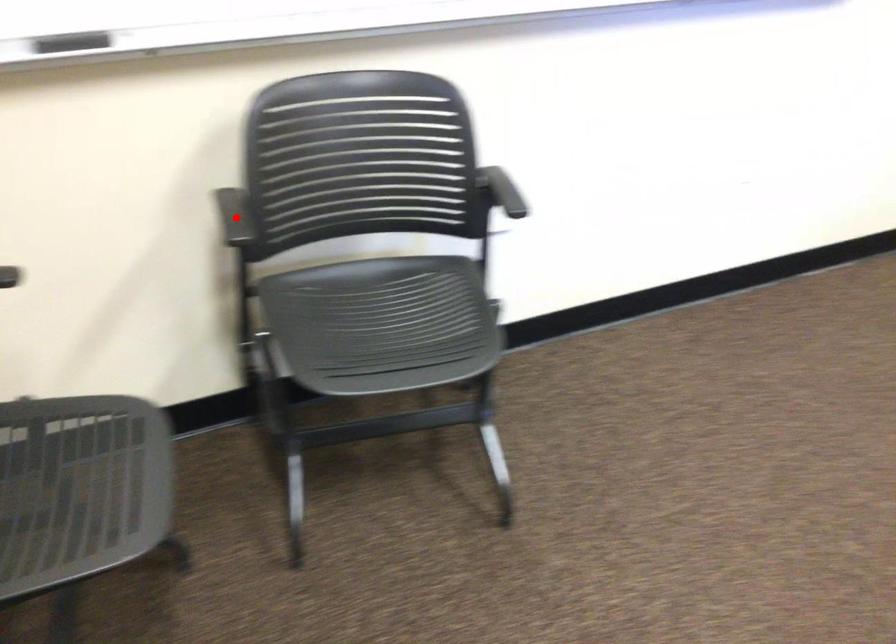
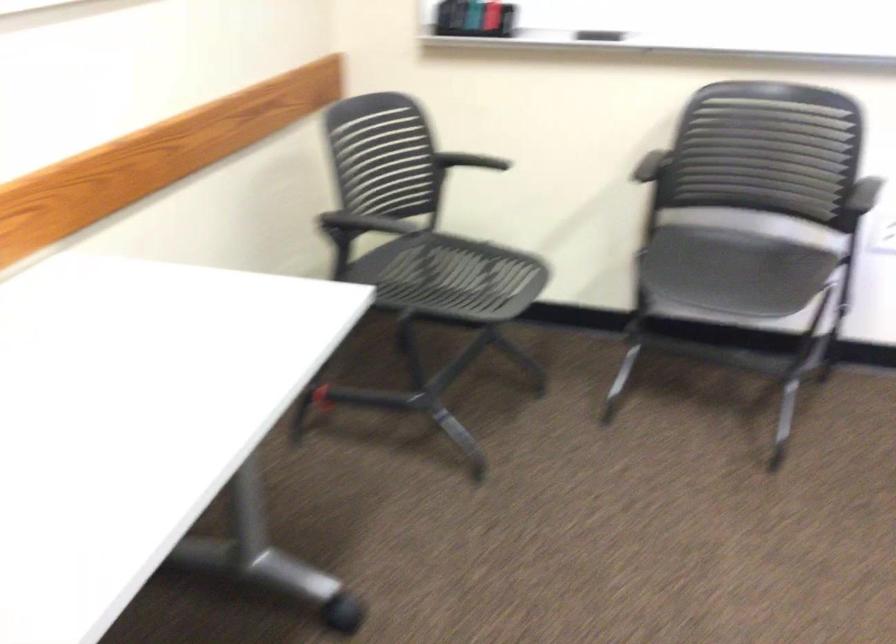
Question: I am providing you with two images of the same scene from different viewpoints. Image1 has a red point marked. In image2, the corresponding 3D location appears at what relative position? Reply with the corresponding letter.

Choices:
 (A) Closer
 (B) Farther

Answer: (B)